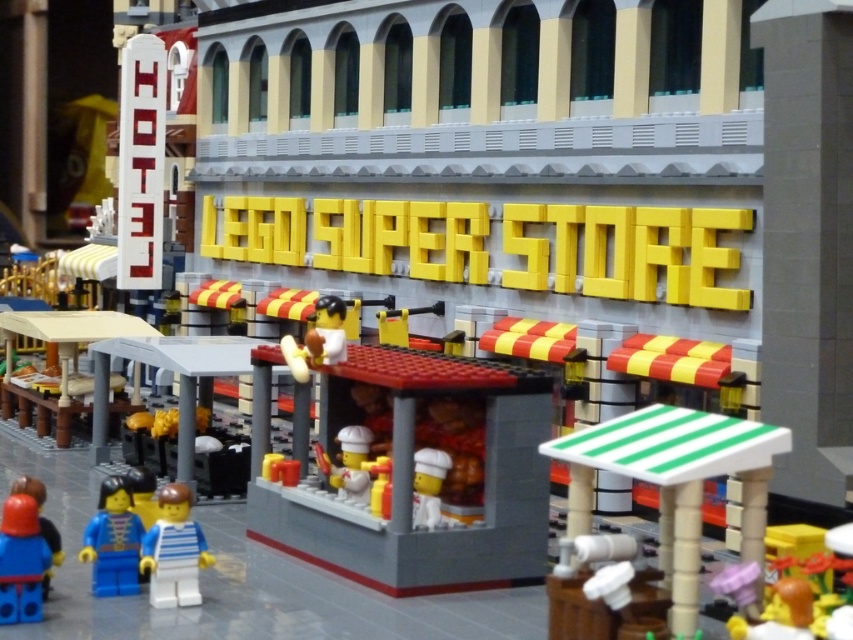
What do you see at coordinates (807, 241) in the screenshot? The width and height of the screenshot is (853, 640). I see `gray matte pillar at right` at bounding box center [807, 241].

Does gray matte pillar at right appear on the right side of matte blue minifigure at lower left?

Correct, you'll find gray matte pillar at right to the right of matte blue minifigure at lower left.

What do you see at coordinates (807, 241) in the screenshot?
I see `gray matte pillar at right` at bounding box center [807, 241].

You are a GUI agent. You are given a task and a screenshot of the screen. Output one action in this format:
    pyautogui.click(x=<x>, y=<y>)
    Task: Click on the gray matte pillar at right
    Image resolution: width=853 pixels, height=640 pixels.
    Given the screenshot: What is the action you would take?
    pyautogui.click(x=807, y=241)

Is light blue plastic minifigure at lower left bigger than blue plastic minifigure at lower left?

Yes, light blue plastic minifigure at lower left is bigger than blue plastic minifigure at lower left.

Does light blue plastic minifigure at lower left have a greater width compared to blue plastic minifigure at lower left?

Correct, the width of light blue plastic minifigure at lower left exceeds that of blue plastic minifigure at lower left.

Which is behind, point (170, 563) or point (107, 548)?

The point (107, 548) is behind.

Image resolution: width=853 pixels, height=640 pixels. Identify the location of light blue plastic minifigure at lower left. (173, 550).

Does light blue plastic minifigure at lower left have a greater width compared to matte blue minifigure at lower left?

Yes.

Who is more distant from viewer, (175, 572) or (35, 518)?

The point (175, 572) is more distant.

Is point (183, 516) more distant than point (39, 545)?

Yes, it is behind point (39, 545).

Locate an element on the screen. The height and width of the screenshot is (640, 853). light blue plastic minifigure at lower left is located at coordinates (173, 550).